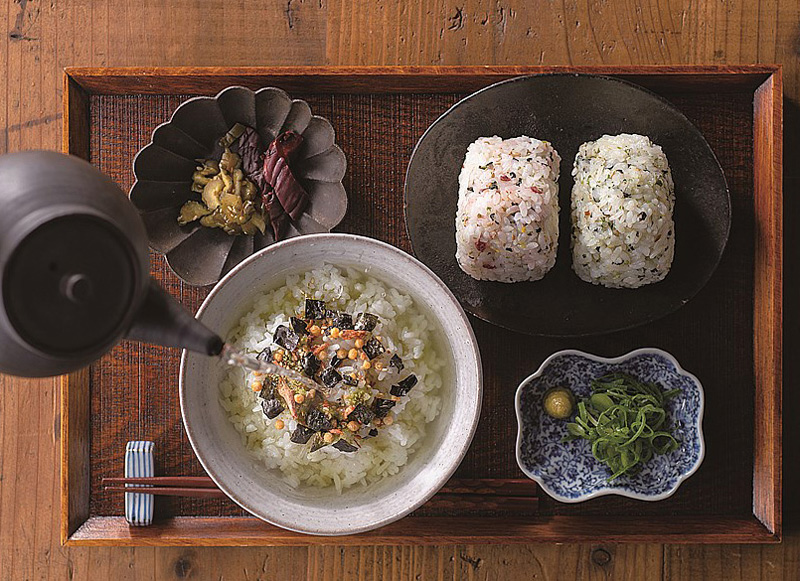
This screenshot has width=800, height=581. Find the location of `chop sticks`. chop sticks is located at coordinates (188, 490), (193, 480).